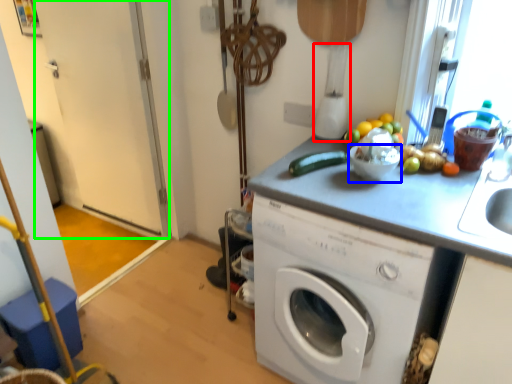
Question: Estimate the real-world distances between objects in this image. Which object is closer to blender (highlighted by a red box), basin (highlighted by a blue box) or screen door (highlighted by a green box)?

Choices:
 (A) basin
 (B) screen door

Answer: (A)